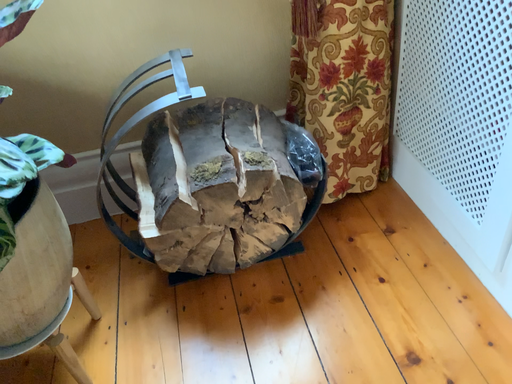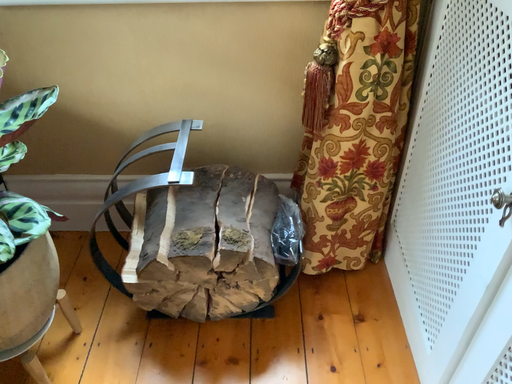
Question: Which way did the camera rotate in the video?

Choices:
 (A) rotated right
 (B) rotated left

Answer: (B)